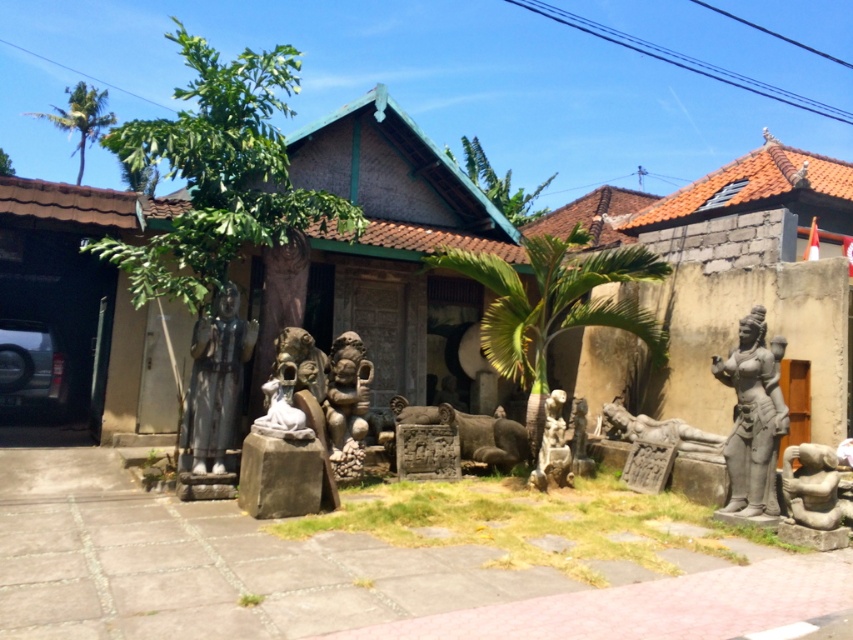
You are a visitor at this traditional building and want to take a photo of both the gray stone statue at right and the white stone statue at center. Which statue should you move closer to in order to include both in the frame without cropping?

You should move closer to the gray stone statue at right because it is larger than the white stone statue at center, allowing you to capture both in the frame while maintaining their visibility.

You are standing at the camera position and want to walk to the matte brown wooden hut at center. The path is clear, but you have a 10 meter long rope tied around your waist. Can you reach the hut without the rope restricting your movement?

The distance between the matte brown wooden hut at center and the camera is 10.01 meters, so the 10 meter rope is slightly shorter than the required distance. You cannot reach the hut without the rope restricting your movement.